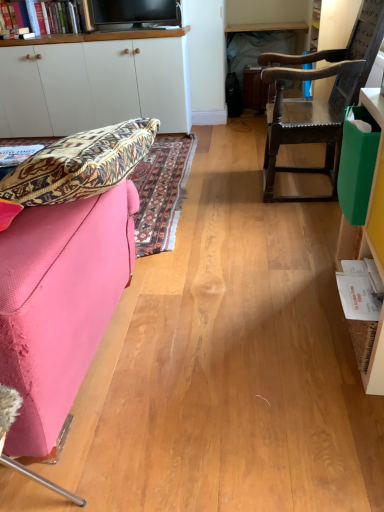
The height and width of the screenshot is (512, 384). Identify the location of vacant area that is in front of dark brown wooden chair at right. (292, 223).